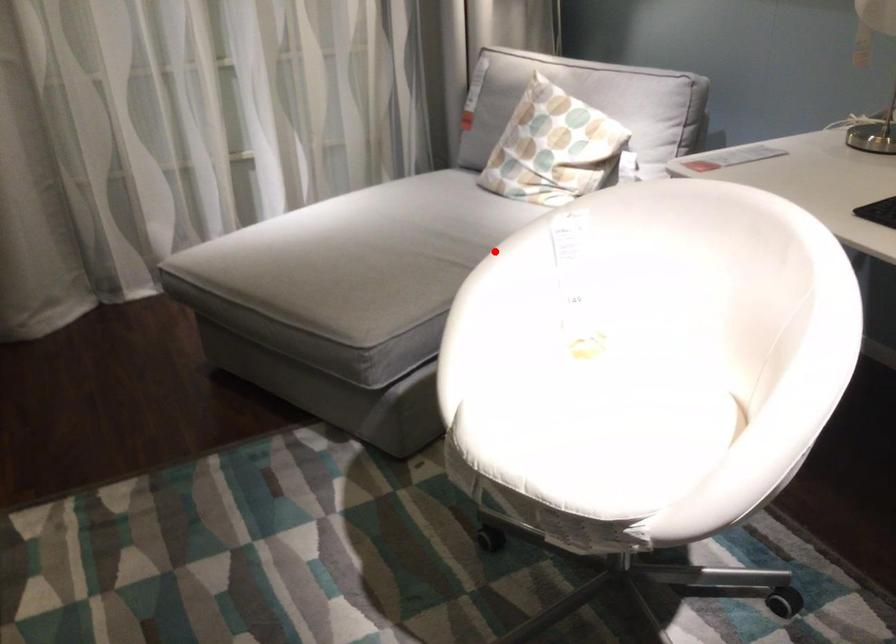
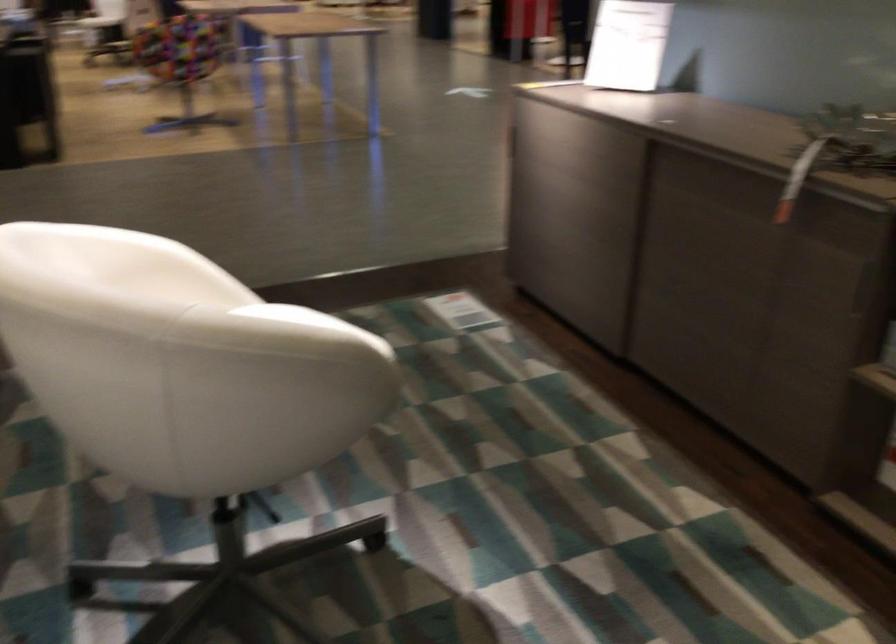
Locate, in the second image, the point that corresponds to the highlighted location in the first image.

(307, 321)